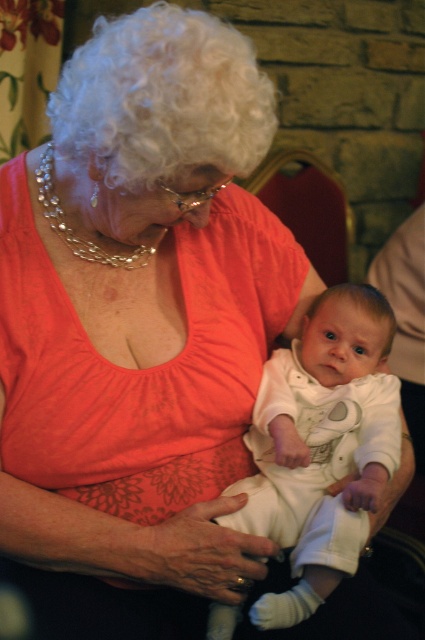
Question: Which object is positioned closest to the white cotton onesie at center?

Choices:
 (A) white curly wig at upper left
 (B) velvet red chair at center
 (C) blonde hair wig at center

Answer: (C)

Question: Is white cotton onesie at center positioned behind white curly wig at upper left?

Choices:
 (A) yes
 (B) no

Answer: (A)

Question: Is white curly wig at upper left above blonde hair wig at center?

Choices:
 (A) yes
 (B) no

Answer: (A)

Question: Which of the following is the farthest from the observer?

Choices:
 (A) white curly wig at upper left
 (B) velvet red chair at center

Answer: (B)

Question: From the image, what is the correct spatial relationship of white curly wig at upper left in relation to velvet red chair at center?

Choices:
 (A) below
 (B) above

Answer: (B)

Question: Which point is farther to the camera?

Choices:
 (A) (150, 116)
 (B) (351, 288)

Answer: (B)